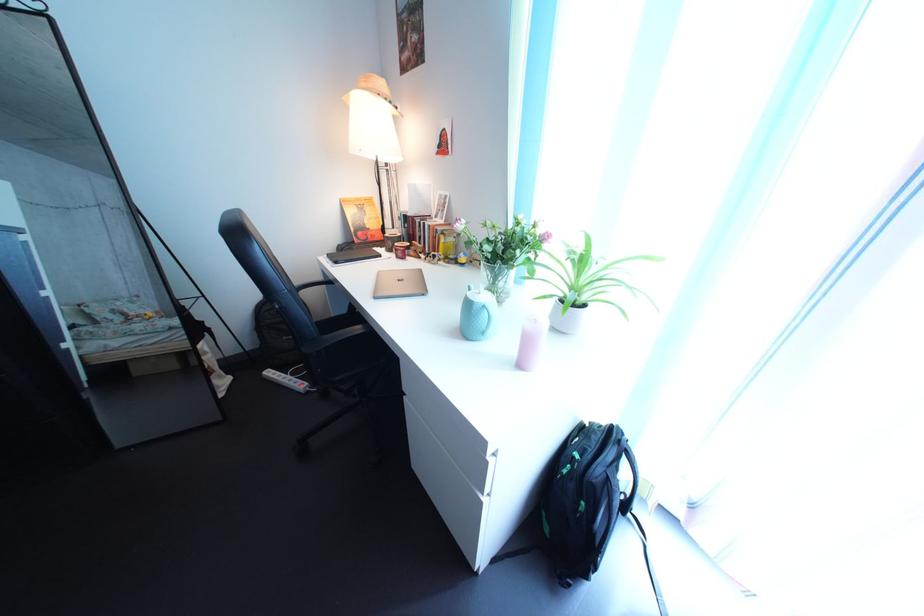
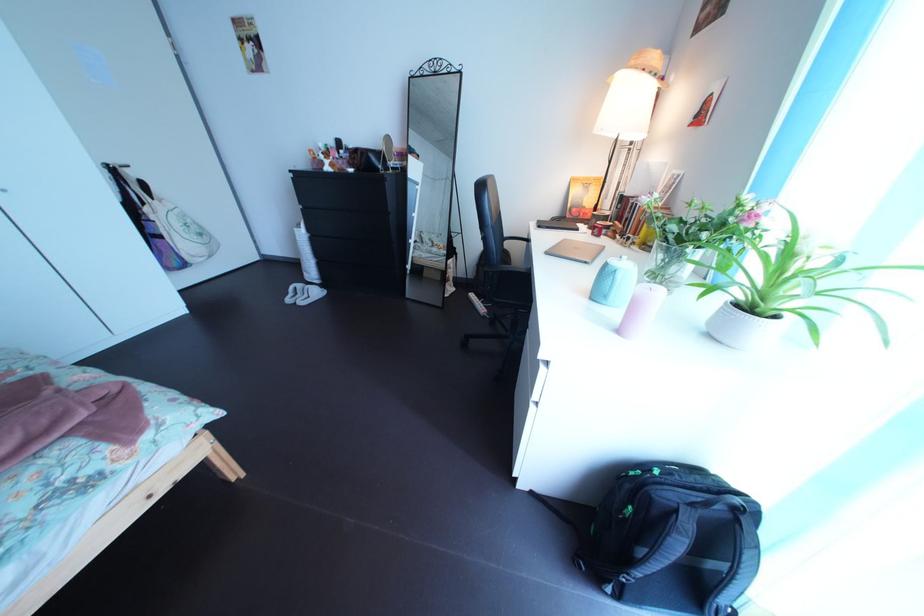
The point at [345,290] is marked in the first image. Where is the corresponding point in the second image?

(541, 248)